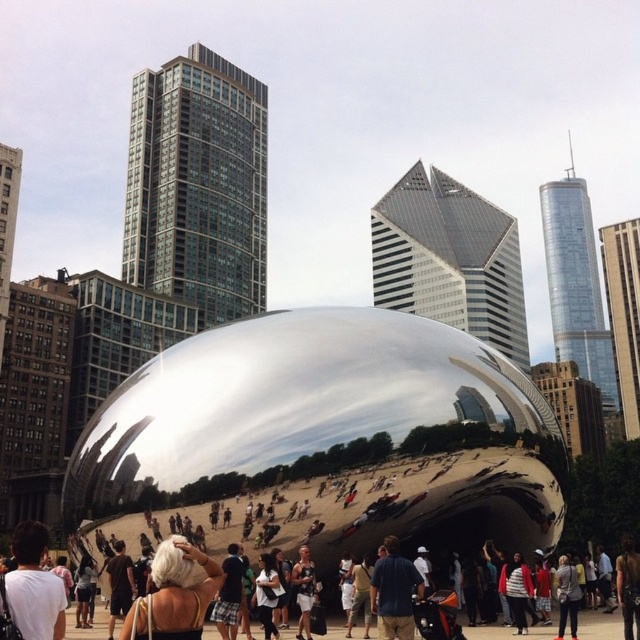
Based on the photo, is blonde hair at center to the right of blue fabric shirt at center from the viewer's perspective?

In fact, blonde hair at center is to the left of blue fabric shirt at center.

Can you confirm if blonde hair at center is taller than blue fabric shirt at center?

Indeed, blonde hair at center has a greater height compared to blue fabric shirt at center.

Describe the element at coordinates (173, 595) in the screenshot. I see `blonde hair at center` at that location.

In order to click on blonde hair at center in this screenshot , I will do `click(173, 595)`.